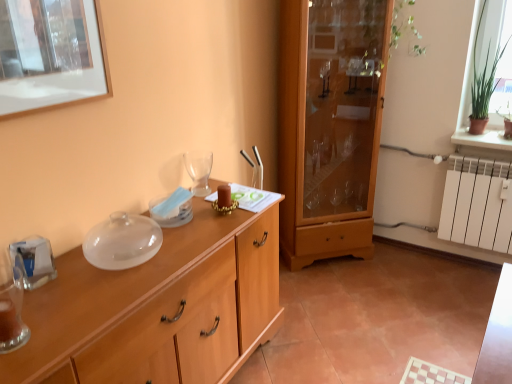
You are a GUI agent. You are given a task and a screenshot of the screen. Output one action in this format:
    pyautogui.click(x=<x>, y=<y>)
    Task: Click on the free space on the front side of wooden cabinet at center
    Image resolution: width=512 pixels, height=384 pixels.
    Given the screenshot: What is the action you would take?
    pyautogui.click(x=343, y=289)